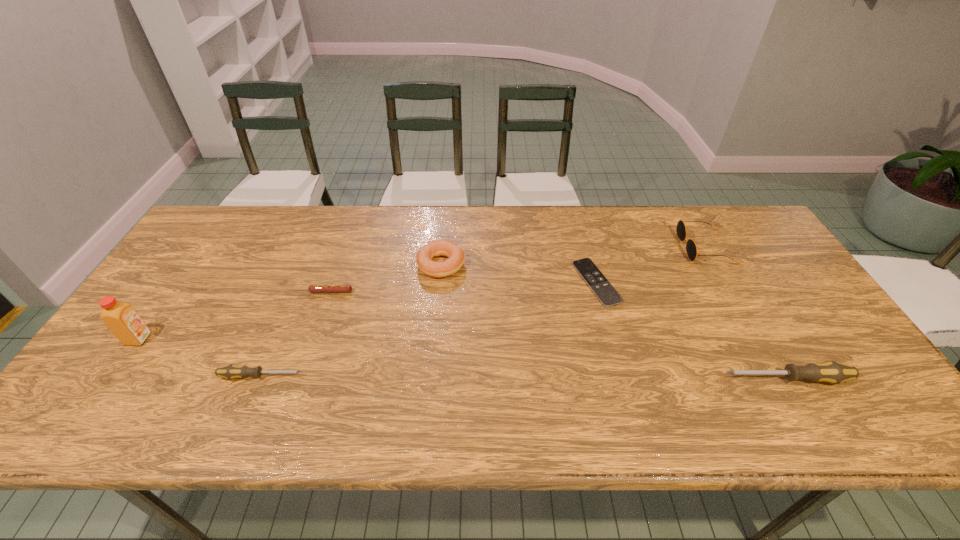
This screenshot has width=960, height=540. Find the location of `vacant space located 0.150m on the front-facing side of the sunglasses`. vacant space located 0.150m on the front-facing side of the sunglasses is located at coordinates (634, 247).

Find the location of a particular element. This screenshot has height=540, width=960. bagel at the far edge is located at coordinates (455, 254).

Where is `sunglasses that is at the far edge`? This screenshot has width=960, height=540. sunglasses that is at the far edge is located at coordinates (691, 248).

The width and height of the screenshot is (960, 540). I want to click on object that is at the left edge, so click(123, 321).

Where is `screwdriver present at the right edge`? screwdriver present at the right edge is located at coordinates (832, 372).

Find the location of a particular element. The image size is (960, 540). sunglasses present at the right edge is located at coordinates (691, 248).

Locate an element on the screen. The image size is (960, 540). object present at the far right corner is located at coordinates (691, 248).

The height and width of the screenshot is (540, 960). Find the location of `object that is at the near right corner`. object that is at the near right corner is located at coordinates (832, 372).

Where is `vacant space at the far edge of the desktop`? vacant space at the far edge of the desktop is located at coordinates (639, 227).

Image resolution: width=960 pixels, height=540 pixels. I want to click on vacant region at the near edge of the desktop, so click(x=413, y=391).